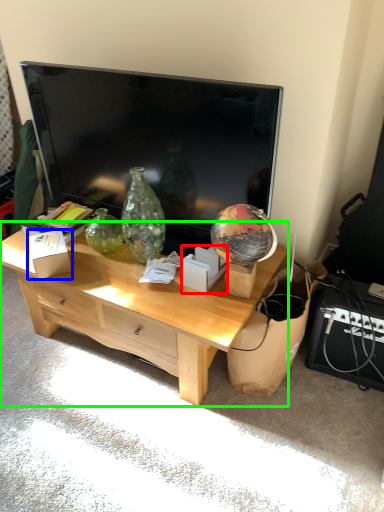
Question: Which is nearer to the cardboard box (highlighted by a red box)? cardboard box (highlighted by a blue box) or desk (highlighted by a green box).

Choices:
 (A) cardboard box
 (B) desk

Answer: (B)